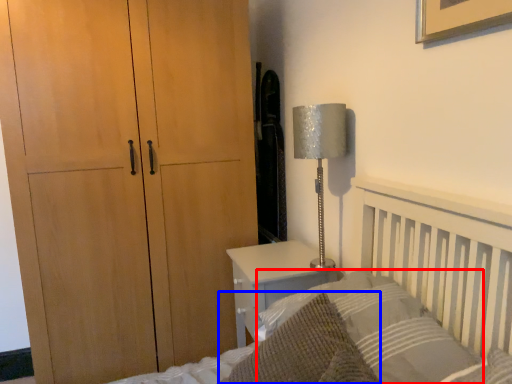
Question: Which of the following is the closest to the observer, pillow (highlighted by a red box) or throw pillow (highlighted by a blue box)?

Choices:
 (A) pillow
 (B) throw pillow

Answer: (B)